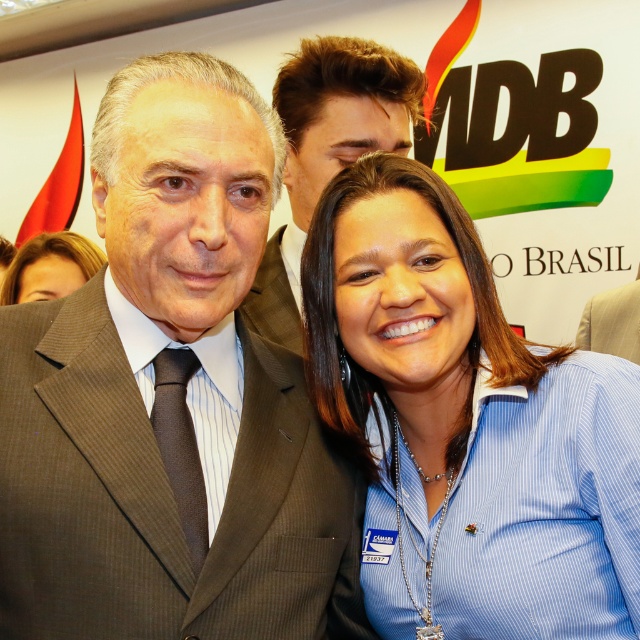
Which of these two, brown suit at center or brown textured tie at center, stands taller?

brown suit at center is taller.

Does point (296, 337) come behind point (163, 436)?

That is True.

You are a GUI agent. You are given a task and a screenshot of the screen. Output one action in this format:
    pyautogui.click(x=<x>, y=<y>)
    Task: Click on the brown suit at center
    The width and height of the screenshot is (640, 640).
    Given the screenshot: What is the action you would take?
    (326, 148)

Where is `brown suit at center`? Image resolution: width=640 pixels, height=640 pixels. brown suit at center is located at coordinates (326, 148).

Who is more distant from viewer, (192, 477) or (72, 257)?

Point (72, 257)

Is the position of brown textured tie at center less distant than that of matte brown hair at lower left?

Yes, brown textured tie at center is in front of matte brown hair at lower left.

Who is more distant from viewer, (177, 369) or (17, 256)?

The point (17, 256) is more distant.

Locate an element on the screen. brown textured tie at center is located at coordinates (180, 445).

Is brown suit at center wider than light brown textured fabric business suit at center?

Correct, the width of brown suit at center exceeds that of light brown textured fabric business suit at center.

Which is in front, point (352, 157) or point (632, 294)?

Point (352, 157) is in front.

The width and height of the screenshot is (640, 640). Identify the location of brown suit at center. (326, 148).